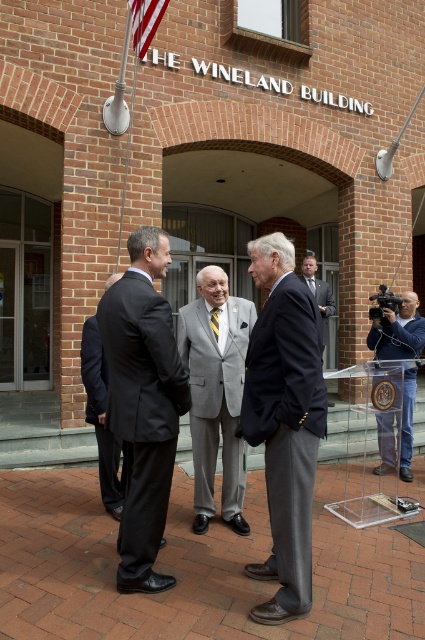
Question: Among these points, which one is nearest to the camera?

Choices:
 (A) (206, 449)
 (B) (294, 337)
 (C) (116, 362)
 (D) (422, 340)

Answer: (B)

Question: Is blue denim jeans at lower right positioned at the back of dark blue suit at center?

Choices:
 (A) yes
 (B) no

Answer: (B)

Question: Is matte black suit at center behind blue denim jeans at lower right?

Choices:
 (A) no
 (B) yes

Answer: (A)

Question: Estimate the real-world distances between objects in this image. Which object is farther from the gray suit at center?

Choices:
 (A) dark gray suit at center
 (B) dark blue suit at center

Answer: (B)

Question: Which object is positioned closest to the matte black suit at center?

Choices:
 (A) navy blue suit at center
 (B) blue denim jeans at lower right

Answer: (A)

Question: Can you confirm if navy blue suit at center is wider than dark blue suit at center?

Choices:
 (A) yes
 (B) no

Answer: (B)